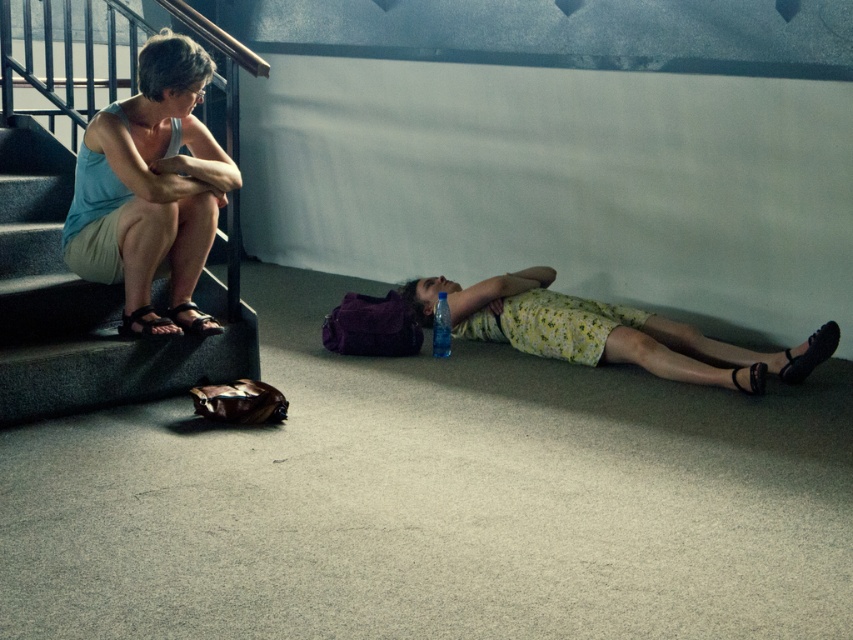
Can you confirm if matte concrete stairs at left is wider than black leather sandal at lower right?

Indeed, matte concrete stairs at left has a greater width compared to black leather sandal at lower right.

Describe the element at coordinates (84, 305) in the screenshot. I see `matte concrete stairs at left` at that location.

Image resolution: width=853 pixels, height=640 pixels. Identify the location of matte concrete stairs at left. (84, 305).

Is point (125, 212) in front of point (769, 362)?

Yes, point (125, 212) is closer to viewer.

Is light blue fabric tank top at upper left shorter than yellow floral dress at lower center?

Incorrect, light blue fabric tank top at upper left's height does not fall short of yellow floral dress at lower center's.

Identify the location of light blue fabric tank top at upper left. Image resolution: width=853 pixels, height=640 pixels. (149, 179).

In the scene shown: Who is more distant from viewer, (720, 349) or (787, 364)?

The point (720, 349) is behind.

Between point (479, 314) and point (805, 364), which one is positioned behind?

The point (479, 314) is behind.

This screenshot has width=853, height=640. In order to click on yellow floral dress at lower center in this screenshot , I will do `click(602, 330)`.